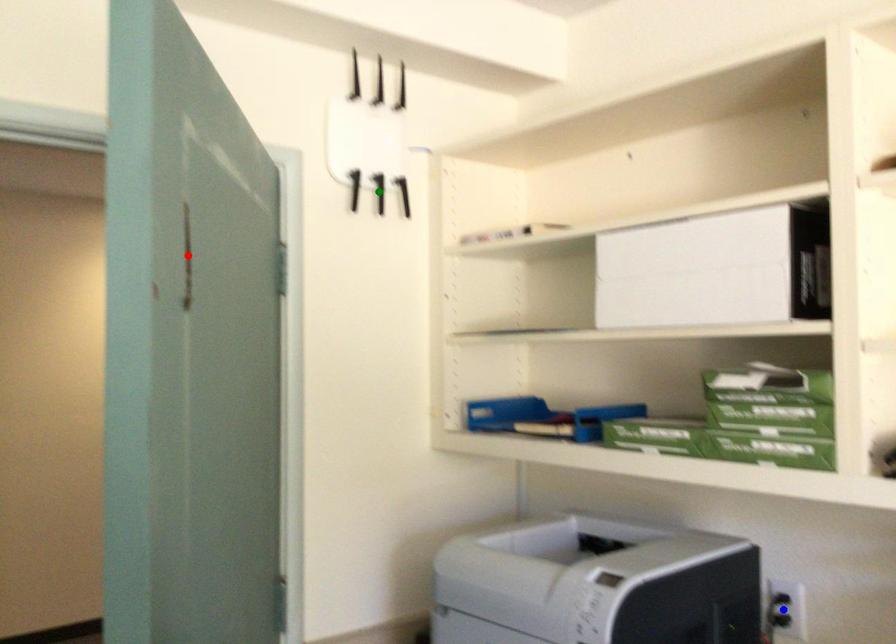
Order these from nearest to farthest:
- red point
- green point
- blue point

red point
blue point
green point